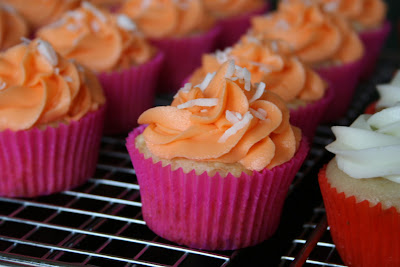
This screenshot has width=400, height=267. What are the coordinates of `rack` in the screenshot? It's located at (95, 226).